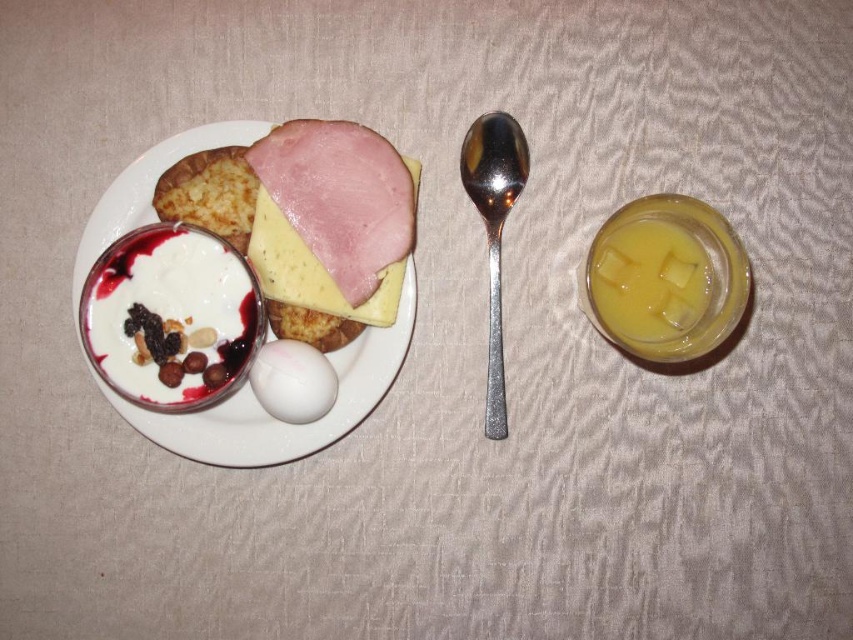
Can you confirm if white creamy yogurt with nuts and berries at center-left is positioned to the left of white glossy egg at center?

Yes, white creamy yogurt with nuts and berries at center-left is to the left of white glossy egg at center.

Is white creamy yogurt with nuts and berries at center-left smaller than white glossy egg at center?

No, white creamy yogurt with nuts and berries at center-left is not smaller than white glossy egg at center.

What are the coordinates of `white creamy yogurt with nuts and berries at center-left` in the screenshot? It's located at (171, 316).

Locate an element on the screen. white creamy yogurt with nuts and berries at center-left is located at coordinates (171, 316).

Does yellow cheese at center come in front of white glossy egg at center?

No, yellow cheese at center is behind white glossy egg at center.

Who is lower down, yellow cheese at center or white glossy egg at center?

Positioned lower is white glossy egg at center.

Between point (386, 307) and point (258, 385), which one is positioned behind?

The point (386, 307) is more distant.

The width and height of the screenshot is (853, 640). What are the coordinates of `yellow cheese at center` in the screenshot? It's located at (311, 272).

Is point (711, 275) less distant than point (267, 380)?

Yes.

Is point (695, 310) closer to viewer compared to point (299, 422)?

That is True.

Identify the location of translucent yellow liquid at right. tap(648, 280).